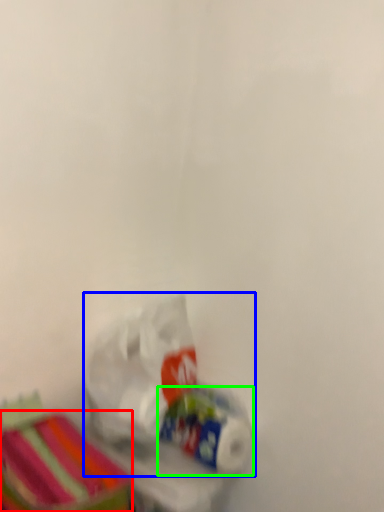
Question: Which is farther away from storage box (highlighted by a red box)? plastic bag (highlighted by a blue box) or toilet paper (highlighted by a green box)?

Choices:
 (A) plastic bag
 (B) toilet paper

Answer: (B)